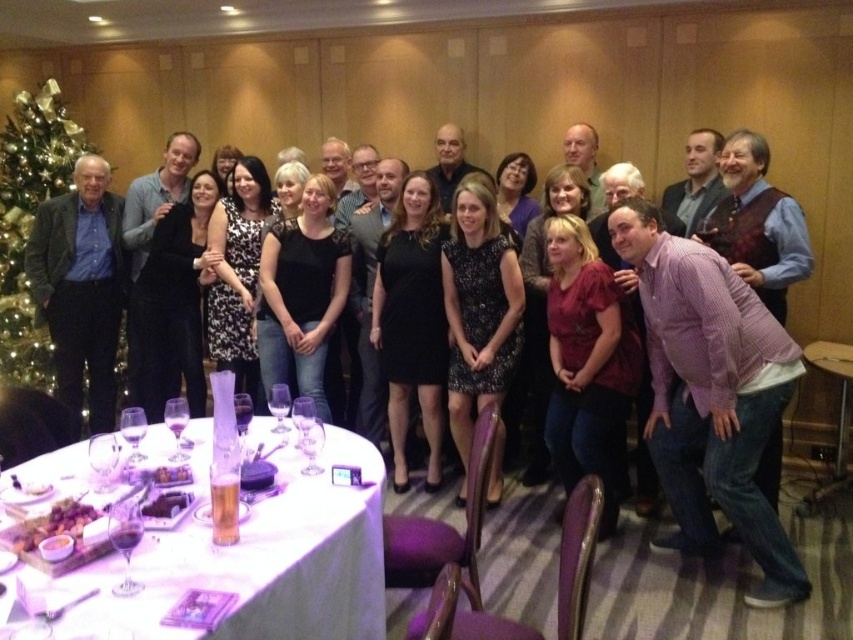
Question: In this image, where is dark brown leather jacket at left located relative to green glittering christmas tree at left?

Choices:
 (A) left
 (B) right

Answer: (B)

Question: Which object is positioned farthest from the white cloth-covered table at lower left?

Choices:
 (A) wooden table at lower right
 (B) green glittering christmas tree at left
 (C) dark brown leather jacket at left

Answer: (A)

Question: Is dark brown leather jacket at left thinner than wooden table at lower right?

Choices:
 (A) yes
 (B) no

Answer: (A)

Question: Which object appears closest to the camera in this image?

Choices:
 (A) wooden table at lower right
 (B) white cloth-covered table at lower left
 (C) dark brown leather jacket at left

Answer: (B)

Question: Which object appears farthest from the camera in this image?

Choices:
 (A) dark brown leather jacket at left
 (B) green glittering christmas tree at left
 (C) wooden table at lower right

Answer: (B)

Question: Does dark brown leather jacket at left have a larger size compared to green glittering christmas tree at left?

Choices:
 (A) no
 (B) yes

Answer: (A)